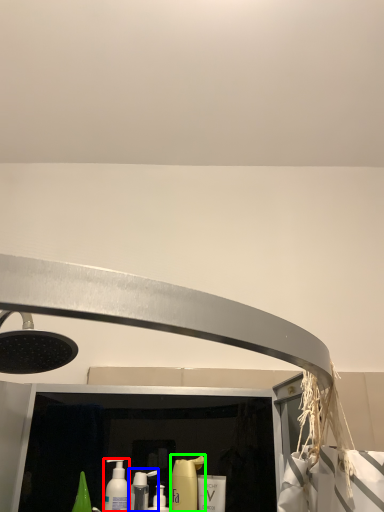
Question: Estimate the real-world distances between objects in this image. Which object is farther from mouthwash (highlighted by a red box), cleaning product (highlighted by a blue box) or cleaning product (highlighted by a green box)?

Choices:
 (A) cleaning product
 (B) cleaning product

Answer: (B)